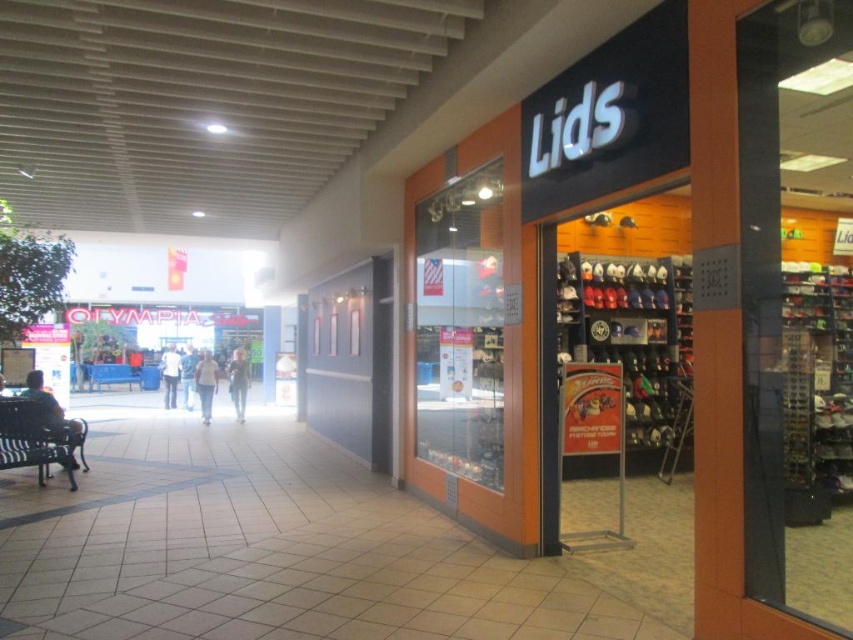
Is black metal bench at left bigger than blue fabric park bench at left?

Yes, black metal bench at left is bigger than blue fabric park bench at left.

What do you see at coordinates (36, 438) in the screenshot? The height and width of the screenshot is (640, 853). I see `black metal bench at left` at bounding box center [36, 438].

What are the coordinates of `black metal bench at left` in the screenshot? It's located at (36, 438).